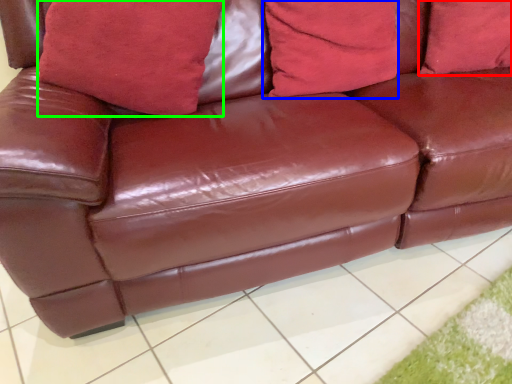
Question: Considering the real-world distances, which object is closest to pillow (highlighted by a red box)? pillow (highlighted by a blue box) or pillow (highlighted by a green box).

Choices:
 (A) pillow
 (B) pillow

Answer: (A)